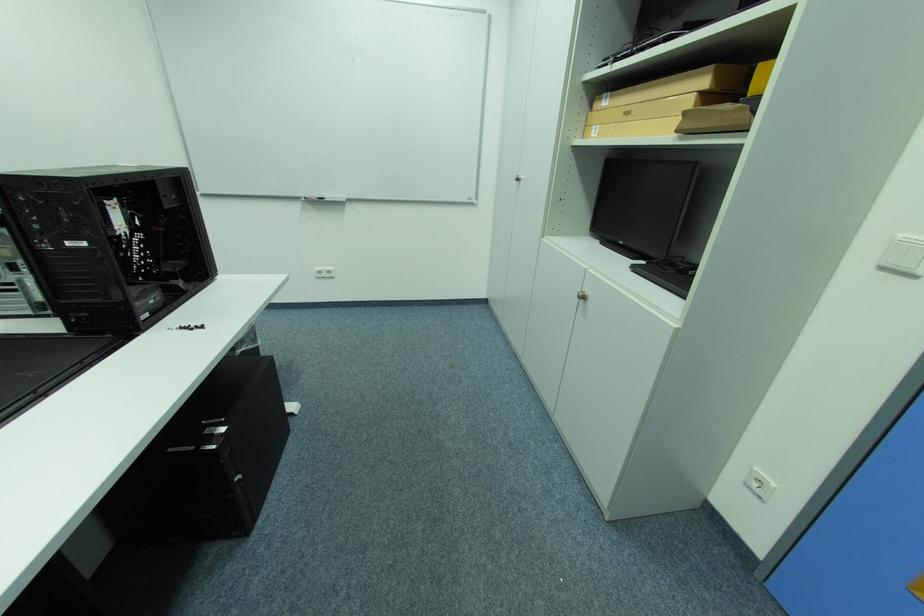
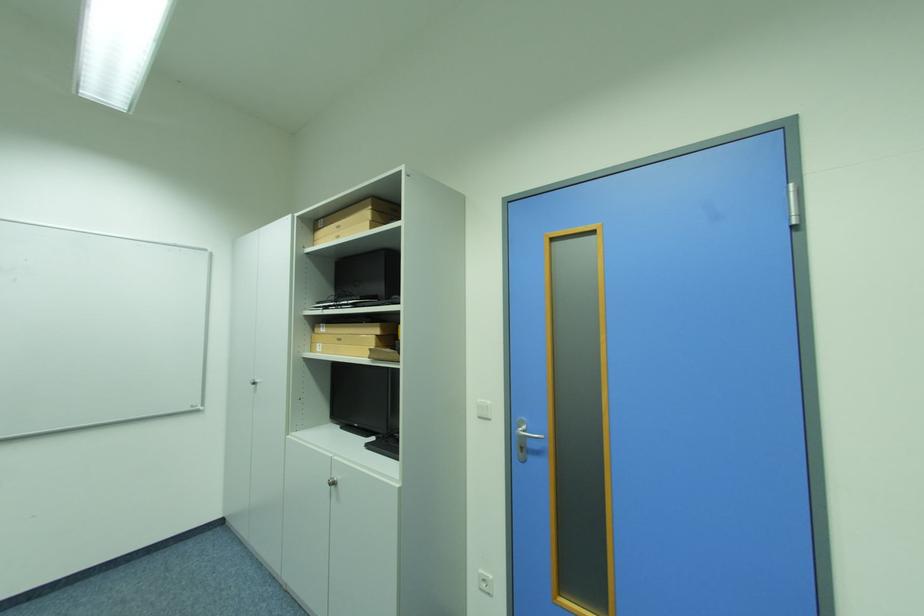
How did the camera likely rotate?

The camera rotated toward right-up.